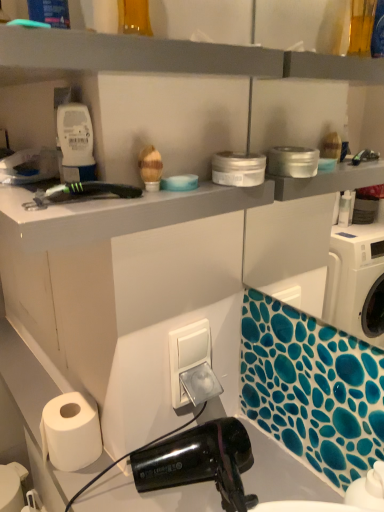
Question: Considering the relative positions of white matte paper towel at lower left and white plastic switch at center in the image provided, is white matte paper towel at lower left to the left or to the right of white plastic switch at center?

Choices:
 (A) right
 (B) left

Answer: (B)

Question: Based on their sizes in the image, would you say white matte paper towel at lower left is bigger or smaller than white plastic switch at center?

Choices:
 (A) small
 (B) big

Answer: (B)

Question: Estimate the real-world distances between objects in this image. Which object is farther from the white matte paper towel at lower left?

Choices:
 (A) gray matte shelf at upper center
 (B) white plastic switch at center

Answer: (A)

Question: Which is farther from the white plastic switch at center?

Choices:
 (A) white matte paper towel at lower left
 (B) gray matte shelf at upper center

Answer: (B)